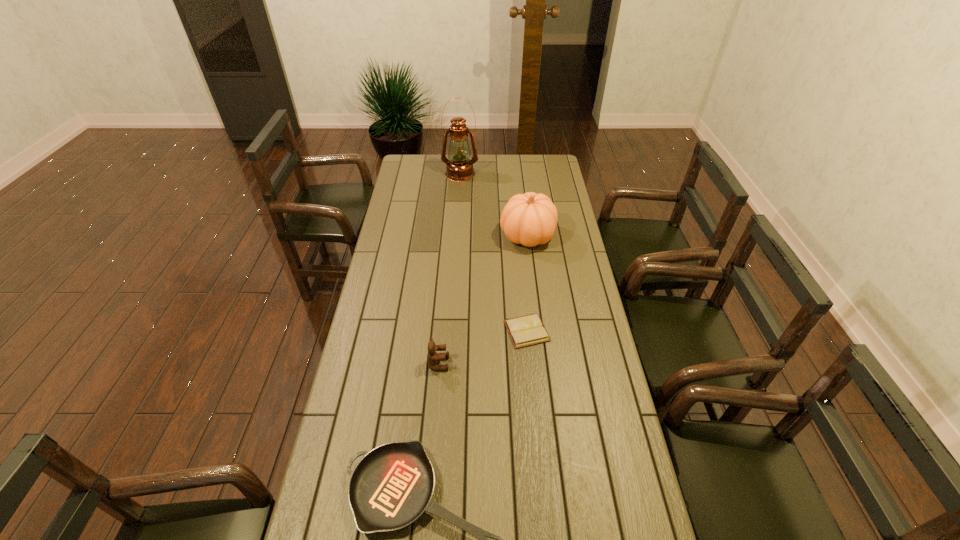
Identify the location of free area in between the fourth farthest object and the farthest object. The width and height of the screenshot is (960, 540). (449, 268).

You are a GUI agent. You are given a task and a screenshot of the screen. Output one action in this format:
    pyautogui.click(x=<x>, y=<y>)
    Task: Click on the free space between the fourth shortest object and the second nearest object
    Image resolution: width=960 pixels, height=540 pixels.
    Given the screenshot: What is the action you would take?
    pyautogui.click(x=483, y=300)

Identify the location of the fourth closest object to the fourth shortest object. The width and height of the screenshot is (960, 540). (392, 485).

You are a GUI agent. You are given a task and a screenshot of the screen. Output one action in this format:
    pyautogui.click(x=<x>, y=<y>)
    Task: Click on the object that is the fourth closest to the fourth farthest object
    
    Given the screenshot: What is the action you would take?
    pyautogui.click(x=459, y=168)

Where is `free region that satisfies the following two spatial constraints: 1. on the front side of the pumpkin; 2. on the left side of the farthest object`? The width and height of the screenshot is (960, 540). free region that satisfies the following two spatial constraints: 1. on the front side of the pumpkin; 2. on the left side of the farthest object is located at coordinates (456, 236).

At what (x,y) coordinates should I click in order to perform the action: click on free location that satisfies the following two spatial constraints: 1. on the back side of the fourth nearest object; 2. on the right side of the diary. Please return your answer as a coordinate pair (x, y). Looking at the image, I should click on (517, 236).